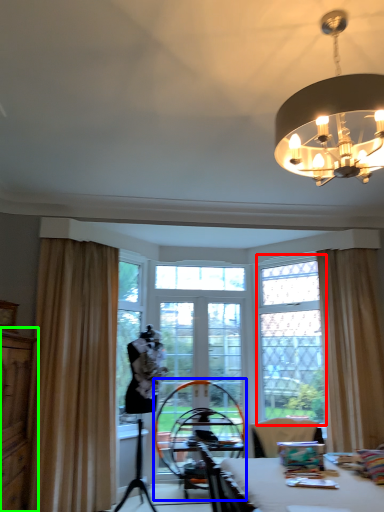
Question: Which is farther away from window frame (highlighted by a red box)? swivel chair (highlighted by a blue box) or dresser (highlighted by a green box)?

Choices:
 (A) swivel chair
 (B) dresser

Answer: (B)